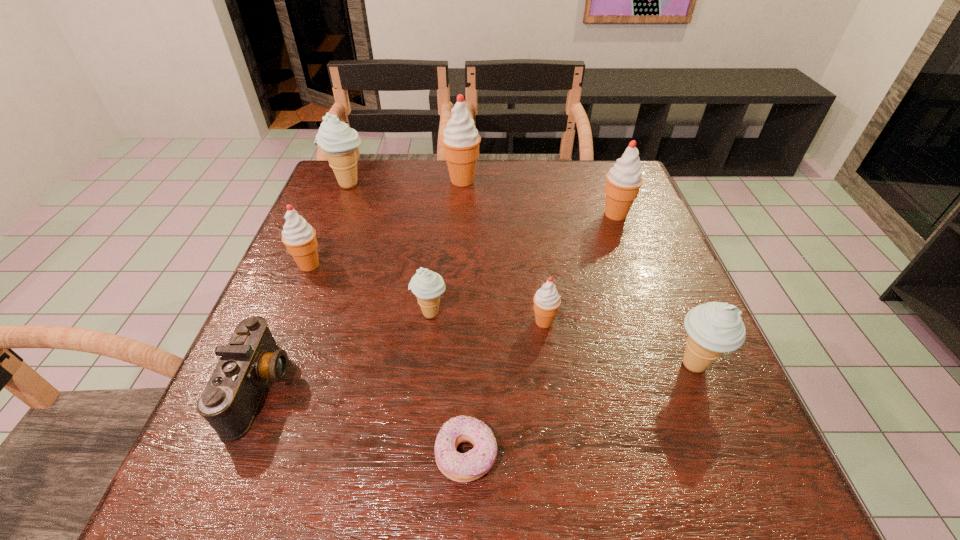
The height and width of the screenshot is (540, 960). What are the coordinates of `vacant space at the far edge of the desktop` in the screenshot? It's located at (435, 190).

This screenshot has height=540, width=960. In the image, there is a desktop. In order to click on blank space at the near edge in this screenshot , I will do `click(327, 494)`.

At what (x,y) coordinates should I click in order to perform the action: click on vacant space at the left edge of the desktop. Please return your answer as a coordinate pair (x, y). This screenshot has width=960, height=540. Looking at the image, I should click on (343, 271).

Identify the location of vacant space at the right edge of the desktop. This screenshot has height=540, width=960. (673, 356).

The width and height of the screenshot is (960, 540). I want to click on vacant area at the far left corner of the desktop, so click(x=379, y=164).

Where is `vacant space at the near left corner of the desktop`? vacant space at the near left corner of the desktop is located at coordinates (299, 456).

In the image, there is a desktop. Identify the location of blank space at the near right corner. The height and width of the screenshot is (540, 960). (706, 507).

Where is `vacant space in between the second farthest beige icecream and the third object from right to left`? The width and height of the screenshot is (960, 540). vacant space in between the second farthest beige icecream and the third object from right to left is located at coordinates (487, 318).

At what (x,y) coordinates should I click in order to perform the action: click on vacant area that lies between the second biggest beige icecream and the doughnut. Please return your answer as a coordinate pair (x, y). Image resolution: width=960 pixels, height=540 pixels. Looking at the image, I should click on (580, 410).

Find the location of a particular element. The width and height of the screenshot is (960, 540). vacant area between the fifth icecream from left to right and the doughnut is located at coordinates (505, 388).